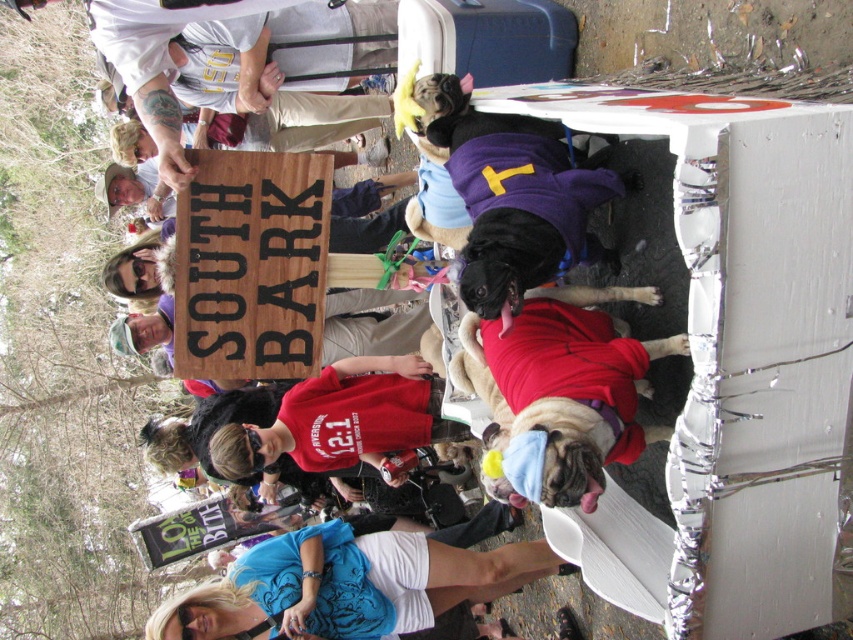
You are a photographer standing at the lower center of the image. You want to take a photo of the blue cotton shirt at lower center and the purple sweater with the number 1 in yellow. How far apart are these two items?

The blue cotton shirt at lower center and the purple sweater with the number 1 in yellow are 5.12 meters apart.

You are a photographer trying to capture a clear shot of the red fabric dog at center and the blue cotton shirt at lower center. Since the image is rotated, you need to adjust your camera. Which object should you focus on first to ensure it appears in front in the final photo?

The blue cotton shirt at lower center should be focused on first because the red fabric dog at center is behind it, so positioning the blue cotton shirt at lower center in front will ensure both are visible with the blue cotton shirt at lower center in the foreground.